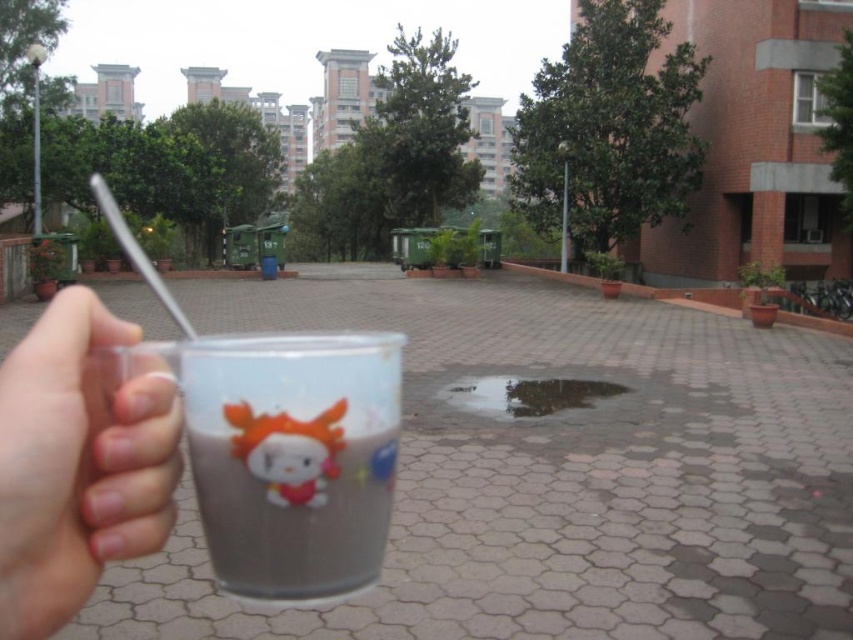
Which is behind, point (328, 440) or point (503, 401)?

Positioned behind is point (503, 401).

This screenshot has width=853, height=640. Find the location of `transparent plastic cup at center`. transparent plastic cup at center is located at coordinates (293, 458).

Between transparent plastic cup at lower left and glossy concrete puddle at center, which one appears on the right side from the viewer's perspective?

From the viewer's perspective, glossy concrete puddle at center appears more on the right side.

Which is behind, point (38, 548) or point (494, 380)?

Point (494, 380)

This screenshot has width=853, height=640. What are the coordinates of `transparent plastic cup at lower left` in the screenshot? It's located at (78, 461).

Is transparent plastic cup at center wider than transparent plastic cup at lower left?

Correct, the width of transparent plastic cup at center exceeds that of transparent plastic cup at lower left.

Who is taller, transparent plastic cup at center or transparent plastic cup at lower left?

transparent plastic cup at center is taller.

I want to click on transparent plastic cup at center, so click(293, 458).